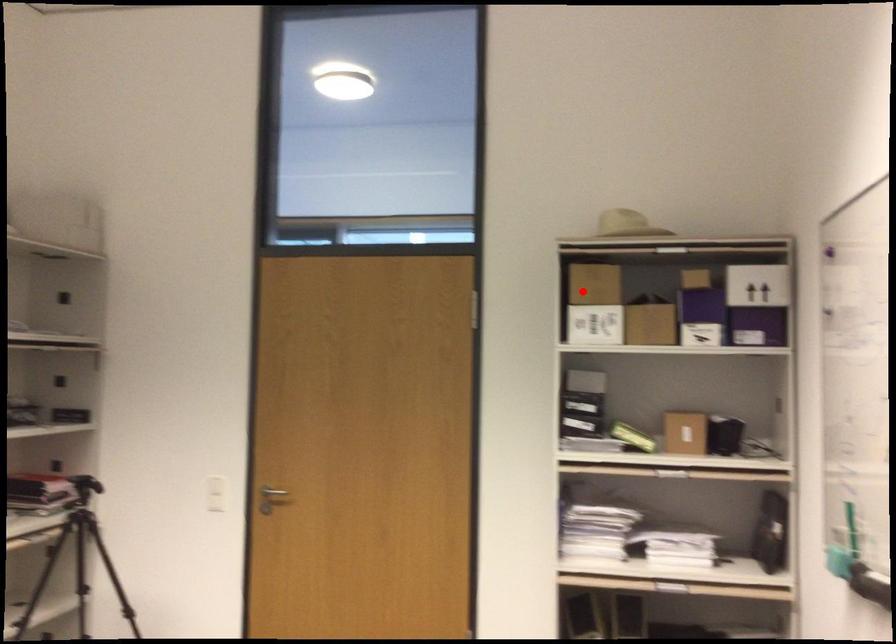
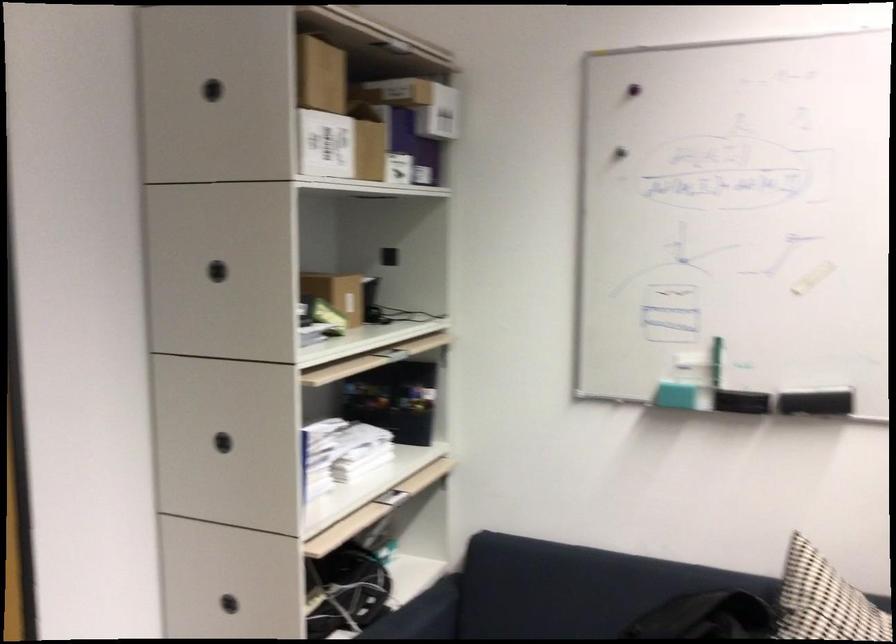
The point at the highlighted location is marked in the first image. Where is the corresponding point in the second image?

(211, 90)